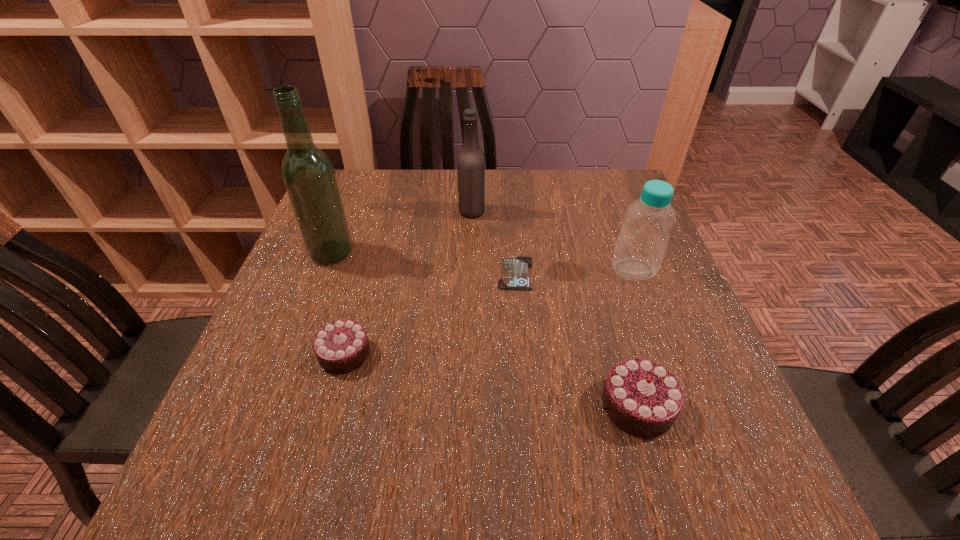
Identify the location of object that is the fourth nearest to the bottle. Image resolution: width=960 pixels, height=540 pixels. (340, 347).

Choose which object is the second nearest neighbor to the identity card. Please provide its 2D coordinates. Your answer should be formatted as a tuple, i.e. [(x, y)], where the tuple contains the x and y coordinates of a point satisfying the conditions above.

[(641, 244)]

I want to click on free location that satisfies the following two spatial constraints: 1. on the back side of the bottle; 2. on the label of the beer bottle, so click(612, 212).

The height and width of the screenshot is (540, 960). In order to click on free spot that satisfies the following two spatial constraints: 1. on the front side of the tallest object; 2. on the right side of the fifth farthest object in this screenshot , I will do `click(293, 353)`.

You are a GUI agent. You are given a task and a screenshot of the screen. Output one action in this format:
    pyautogui.click(x=<x>, y=<y>)
    Task: Click on the free location that satisfies the following two spatial constraints: 1. on the label of the fifth shortest object; 2. on the right side of the nearer chocolate cake
    
    Given the screenshot: What is the action you would take?
    pyautogui.click(x=468, y=406)

I want to click on vacant position in the image that satisfies the following two spatial constraints: 1. on the label of the beer bottle; 2. on the front side of the tallest object, so click(471, 253).

Identify the location of free location that satisfies the following two spatial constraints: 1. on the label of the fourth tallest object; 2. on the right side of the fifth shortest object. (468, 406).